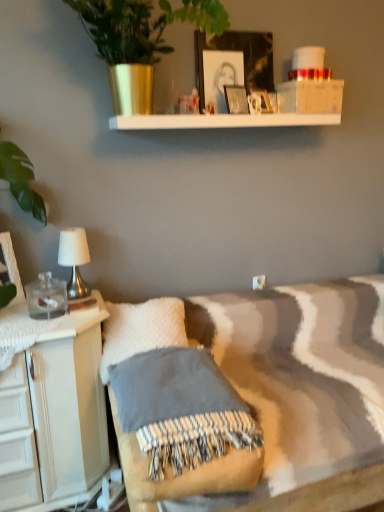
Question: Is metallic green plant at upper center positioned beyond the bounds of matte glass picture frame at upper center, positioned as the third picture frame in right-to-left order?

Choices:
 (A) no
 (B) yes

Answer: (B)

Question: Does metallic green plant at upper center have a lesser height compared to matte glass picture frame at upper center, positioned as the third picture frame in right-to-left order?

Choices:
 (A) no
 (B) yes

Answer: (A)

Question: Can you confirm if metallic green plant at upper center is bigger than matte glass picture frame at upper center, which ranks as the second picture frame in left-to-right order?

Choices:
 (A) yes
 (B) no

Answer: (A)

Question: Can you confirm if metallic green plant at upper center is positioned to the left of matte glass picture frame at upper center, marked as the 2th picture frame in a bottom-to-top arrangement?

Choices:
 (A) no
 (B) yes

Answer: (B)

Question: From the image's perspective, would you say metallic green plant at upper center is shown under matte glass picture frame at upper center, arranged as the third picture frame when viewed from the top?

Choices:
 (A) yes
 (B) no

Answer: (B)

Question: In the image, is metallic green plant at upper center on the left side or the right side of white fabric-covered lamp at left?

Choices:
 (A) left
 (B) right

Answer: (B)

Question: In terms of height, does metallic green plant at upper center look taller or shorter compared to white fabric-covered lamp at left?

Choices:
 (A) short
 (B) tall

Answer: (B)

Question: Considering their positions, is metallic green plant at upper center located in front of or behind white fabric-covered lamp at left?

Choices:
 (A) behind
 (B) front

Answer: (B)

Question: Based on their sizes in the image, would you say metallic green plant at upper center is bigger or smaller than white fabric-covered lamp at left?

Choices:
 (A) small
 (B) big

Answer: (B)

Question: From a real-world perspective, is metallic green plant at upper center above or below white fluffy pillow at lower left?

Choices:
 (A) above
 (B) below

Answer: (A)

Question: Is metallic green plant at upper center inside or outside of white fluffy pillow at lower left?

Choices:
 (A) inside
 (B) outside

Answer: (B)

Question: Relative to white fluffy pillow at lower left, is metallic green plant at upper center in front or behind?

Choices:
 (A) front
 (B) behind

Answer: (A)

Question: Is metallic green plant at upper center taller or shorter than white fluffy pillow at lower left?

Choices:
 (A) tall
 (B) short

Answer: (A)

Question: Relative to matte white picture frame at left, the 4th picture frame from the right, is white fabric-covered lamp at left in front or behind?

Choices:
 (A) front
 (B) behind

Answer: (B)

Question: Is white fabric-covered lamp at left wider or thinner than matte white picture frame at left, the fourth picture frame positioned from the top?

Choices:
 (A) wide
 (B) thin

Answer: (A)